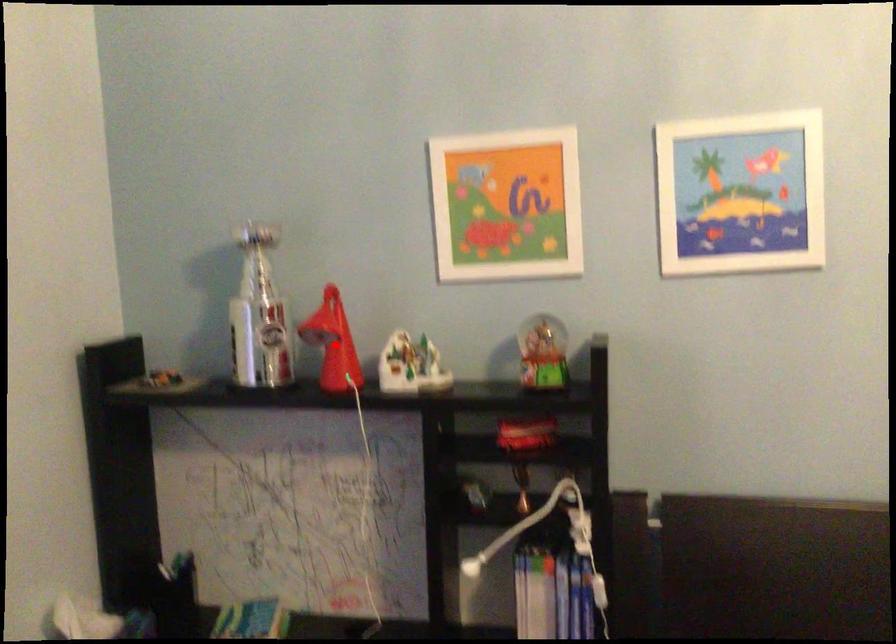
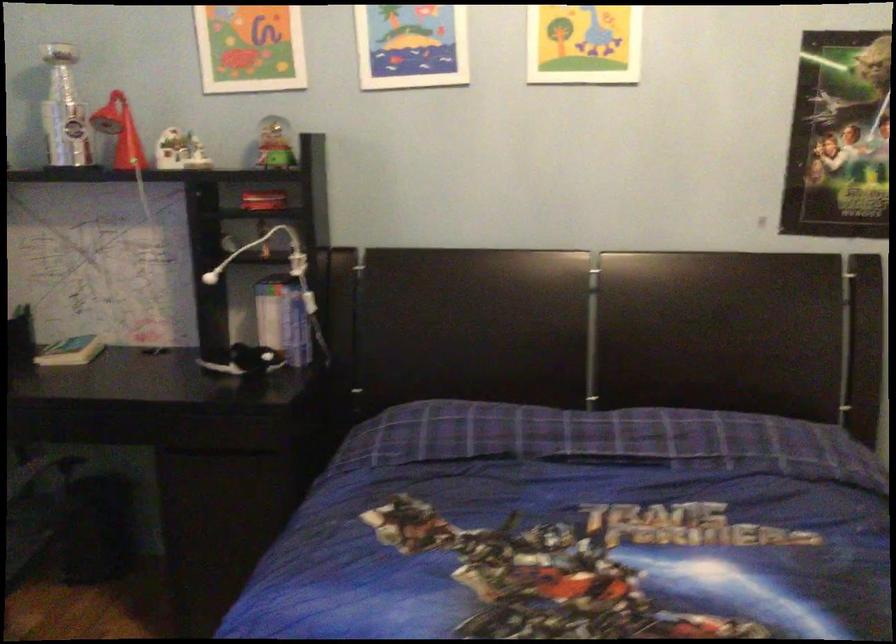
Find the pixel in the second image that matches the highlighted location in the first image.

(119, 131)